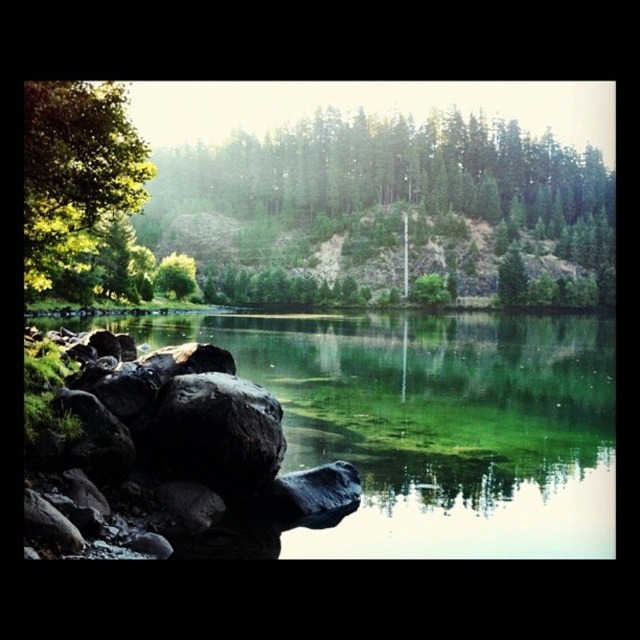
Is green leafy tree at left smaller than black matte rock at lower left?

No.

Is green leafy tree at left shorter than black matte rock at lower left?

No.

What are the coordinates of `green leafy tree at left` in the screenshot? It's located at (76, 172).

Between green smooth water at center and green leafy tree at left, which one is positioned higher?

Positioned higher is green leafy tree at left.

Can you confirm if green smooth water at center is thinner than green leafy tree at left?

No.

Does point (448, 541) come behind point (152, 168)?

No, (448, 541) is closer to viewer.

The height and width of the screenshot is (640, 640). Find the location of `green smooth water at center`. green smooth water at center is located at coordinates (444, 426).

Does green smooth water at center appear over black matte rock at lower left?

Yes, green smooth water at center is above black matte rock at lower left.

Locate an element on the screen. green smooth water at center is located at coordinates point(444,426).

I want to click on green smooth water at center, so (x=444, y=426).